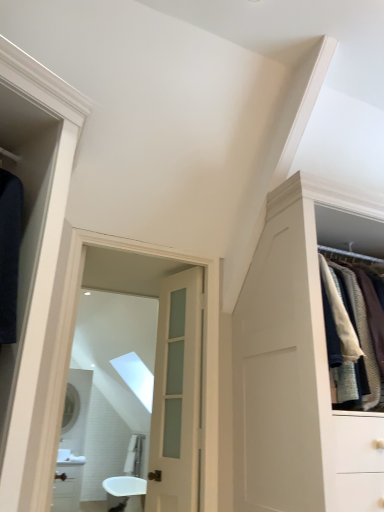
Question: Can you confirm if clear glass mirror at center, the 2th mirror in the left-to-right sequence, is wider than satin white door at center?

Choices:
 (A) no
 (B) yes

Answer: (B)

Question: Is clear glass mirror at center, positioned as the 2th mirror in bottom-to-top order, positioned with its back to satin white door at center?

Choices:
 (A) no
 (B) yes

Answer: (B)

Question: Is clear glass mirror at center, positioned as the 1th mirror in right-to-left order, at the left side of satin white door at center?

Choices:
 (A) yes
 (B) no

Answer: (A)

Question: Can you confirm if clear glass mirror at center, positioned as the 1th mirror in front-to-back order, is bigger than satin white door at center?

Choices:
 (A) yes
 (B) no

Answer: (A)

Question: Is satin white door at center completely or partially inside clear glass mirror at center, positioned as the 2th mirror in bottom-to-top order?

Choices:
 (A) no
 (B) yes

Answer: (A)

Question: Based on their positions, is white glossy sink at center located to the left or right of satin white door at center?

Choices:
 (A) right
 (B) left

Answer: (B)

Question: Considering the positions of white glossy sink at center and satin white door at center in the image, is white glossy sink at center wider or thinner than satin white door at center?

Choices:
 (A) thin
 (B) wide

Answer: (B)

Question: Relative to satin white door at center, is white glossy sink at center in front or behind?

Choices:
 (A) behind
 (B) front

Answer: (A)

Question: From their relative heights in the image, would you say white glossy sink at center is taller or shorter than satin white door at center?

Choices:
 (A) short
 (B) tall

Answer: (A)

Question: Is clear glass mirror at center, positioned as the 1th mirror in right-to-left order, bigger or smaller than matte silver mirror at center, positioned as the 2th mirror in front-to-back order?

Choices:
 (A) small
 (B) big

Answer: (B)

Question: Is clear glass mirror at center, positioned as the 1th mirror in right-to-left order, taller or shorter than matte silver mirror at center, positioned as the 2th mirror in front-to-back order?

Choices:
 (A) tall
 (B) short

Answer: (A)

Question: Considering the positions of clear glass mirror at center, which appears as the first mirror when viewed from the top, and matte silver mirror at center, the 2th mirror viewed from the top, in the image, is clear glass mirror at center, which appears as the first mirror when viewed from the top, wider or thinner than matte silver mirror at center, the 2th mirror viewed from the top,?

Choices:
 (A) wide
 (B) thin

Answer: (A)

Question: From the image's perspective, is clear glass mirror at center, which appears as the first mirror when viewed from the top, above or below matte silver mirror at center, placed as the 1th mirror when sorted from left to right?

Choices:
 (A) below
 (B) above

Answer: (B)

Question: Is satin white door at center wider or thinner than matte silver mirror at center, the 2th mirror viewed from the top?

Choices:
 (A) thin
 (B) wide

Answer: (B)

Question: Considering the positions of point (178, 313) and point (66, 407), is point (178, 313) closer or farther from the camera than point (66, 407)?

Choices:
 (A) closer
 (B) farther

Answer: (B)